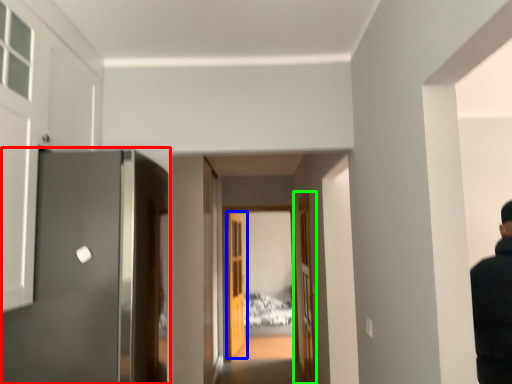
Question: Considering the real-world distances, which object is farthest from door (highlighted by a red box)? door (highlighted by a blue box) or door (highlighted by a green box)?

Choices:
 (A) door
 (B) door

Answer: (A)